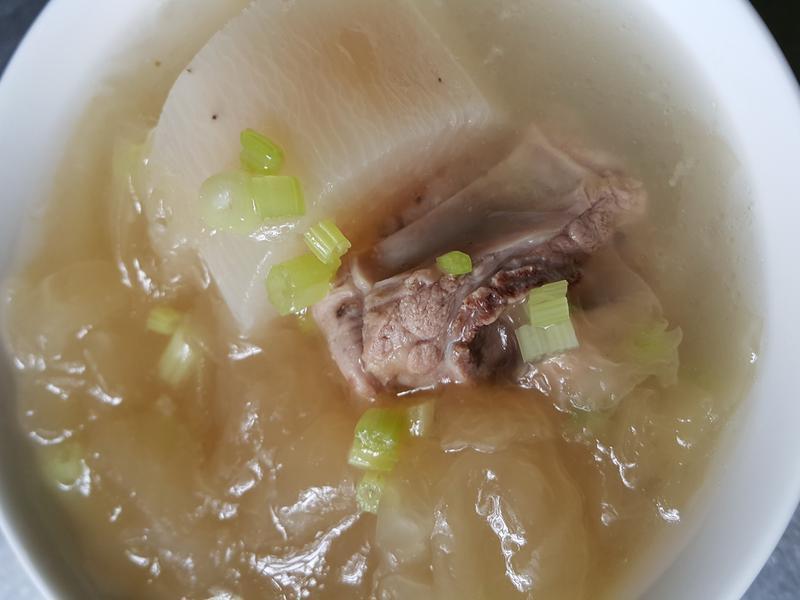
Image resolution: width=800 pixels, height=600 pixels. Identify the location of counter. (782, 577).